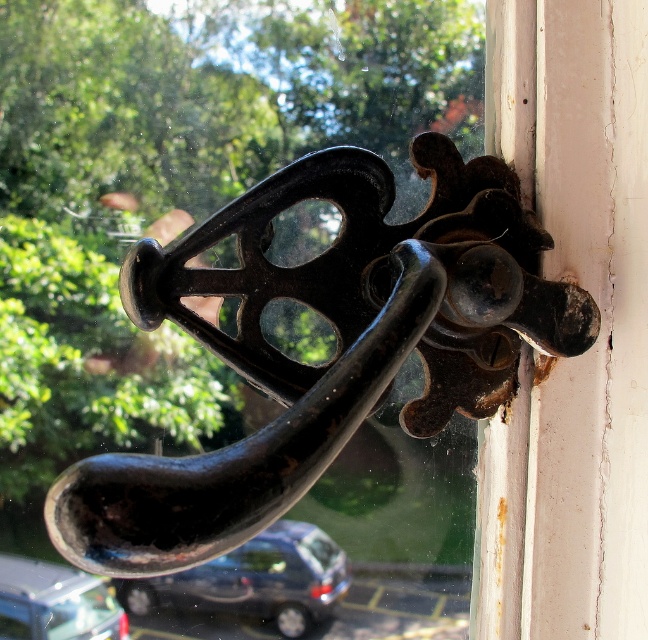
You are standing in front of the window and see two points marked on the door handle. Which point, point (319, 310) or point (93, 604), is closer to your eyes?

Point (319, 310) is further to the viewer than point (93, 604), so the point closer to your eyes is point (93, 604).

You are an architect designing a new building and want to replicate the position of the black cast iron handle at center from the image. What are the coordinates of the handle?

The coordinates of the black cast iron handle at center are at point (338, 346).